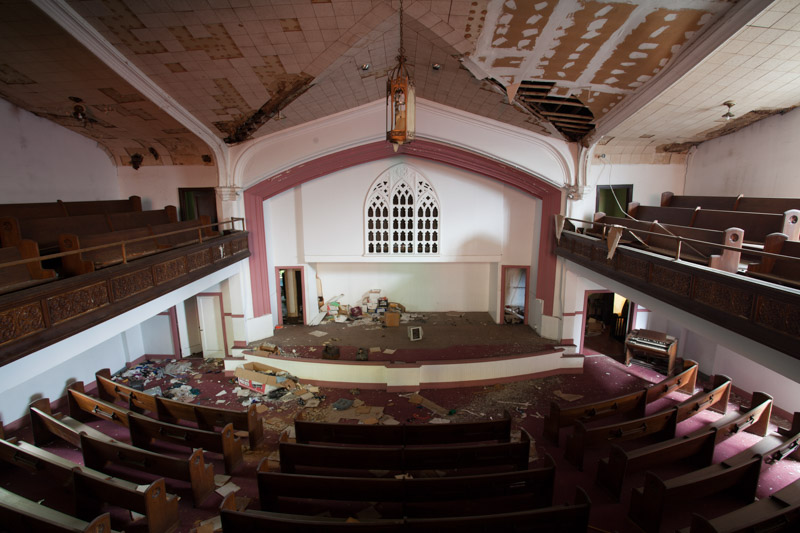
Find the location of a particular element. Image resolution: width=800 pixels, height=533 pixels. organ is located at coordinates 660,349.